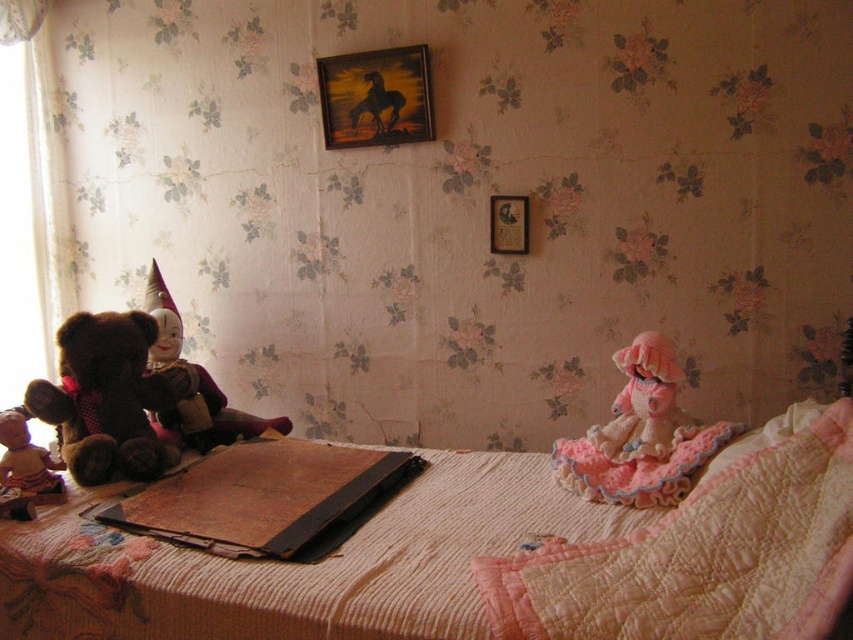
Does pink crocheted doll at right lie in front of matte pink doll at lower left?

That is True.

Which is above, pink crocheted doll at right or matte pink doll at lower left?

pink crocheted doll at right is higher up.

Is point (624, 408) farther from viewer compared to point (55, 477)?

Yes, point (624, 408) is behind point (55, 477).

Where is `pink crocheted doll at right`? pink crocheted doll at right is located at coordinates (641, 435).

Can you confirm if wooden framed painting at upper center is wider than wooden picture frame at upper center?

Correct, the width of wooden framed painting at upper center exceeds that of wooden picture frame at upper center.

Can you confirm if wooden framed painting at upper center is smaller than wooden picture frame at upper center?

No.

Does point (397, 77) come behind point (521, 216)?

That is True.

In order to click on wooden framed painting at upper center in this screenshot , I will do `click(375, 97)`.

Who is more forward, (682,438) or (390,124)?

Point (682,438) is more forward.

Can you confirm if pink crocheted doll at right is positioned to the left of black glossy horse at upper center?

Incorrect, pink crocheted doll at right is not on the left side of black glossy horse at upper center.

Which is behind, point (660, 364) or point (372, 90)?

The point (372, 90) is behind.

Identify the location of pink crocheted doll at right. (641, 435).